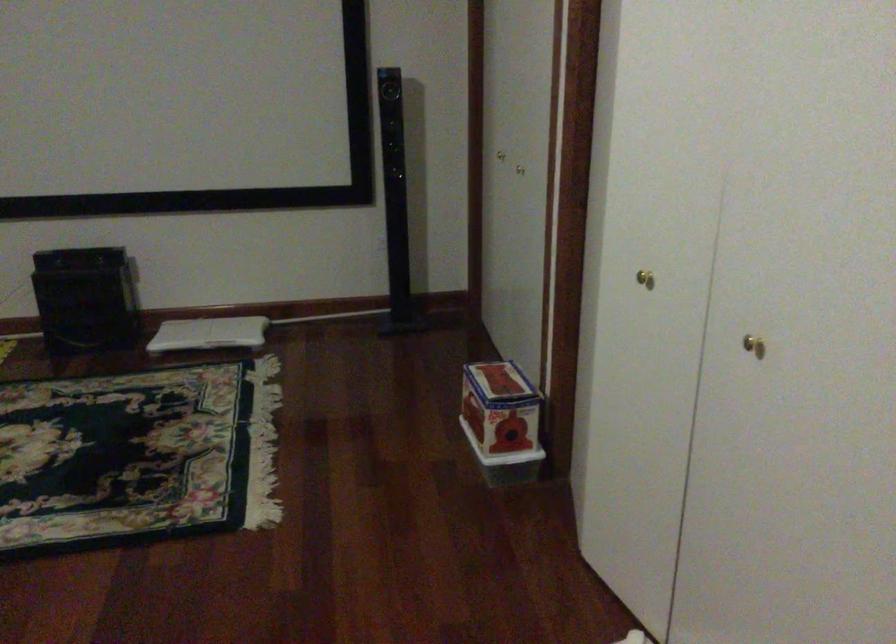
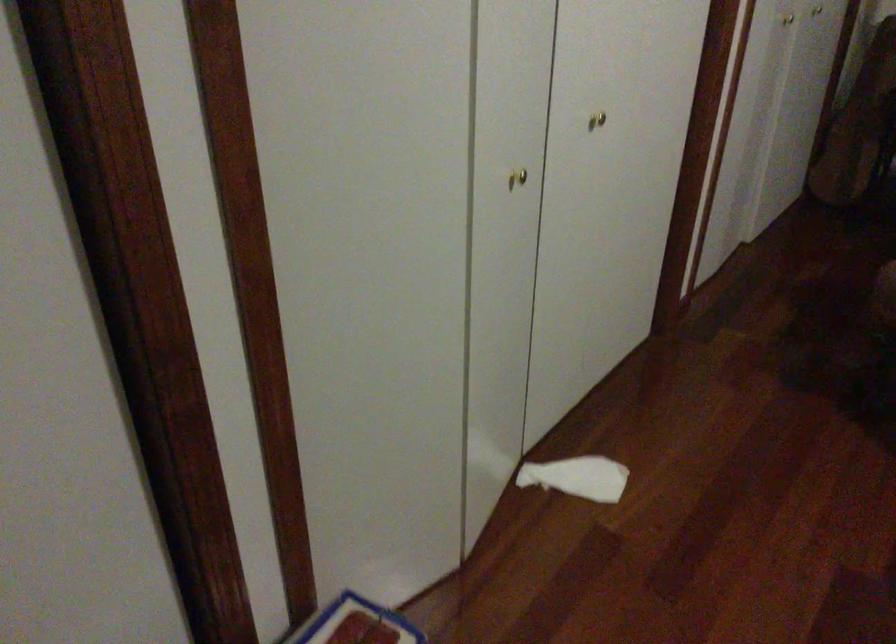
Find the pixel in the second image that matches point 794,389 in the first image.

(597, 120)